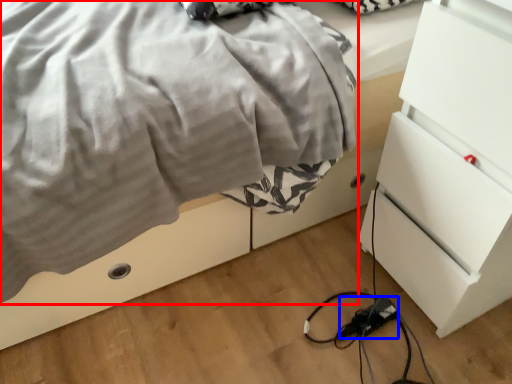
Question: Which object appears closest to the camera in this image, blanket (highlighted by a red box) or extension cord (highlighted by a blue box)?

Choices:
 (A) blanket
 (B) extension cord

Answer: (A)